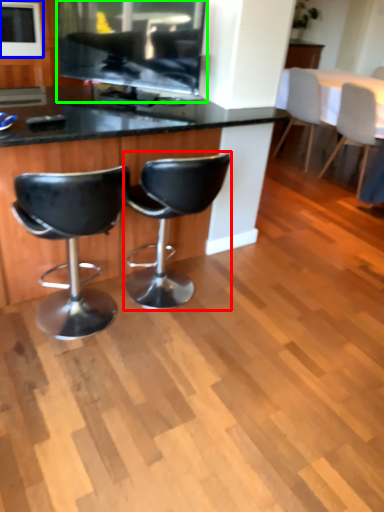
Question: Estimate the real-world distances between objects in this image. Which object is farther from chair (highlighted by a red box), appliance (highlighted by a blue box) or appliance (highlighted by a green box)?

Choices:
 (A) appliance
 (B) appliance

Answer: (A)